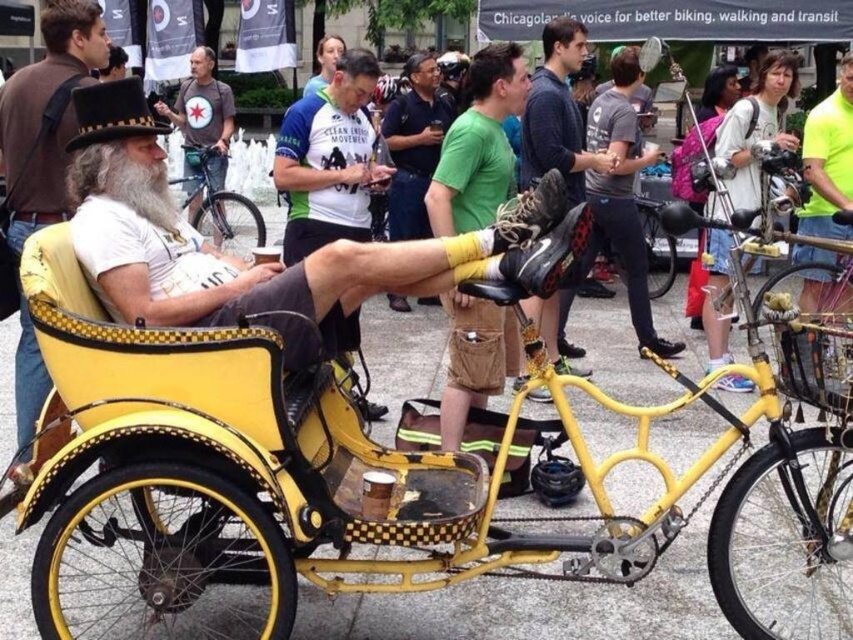
You are a photographer trying to capture a photo of both the green cotton shirt at center and the shiny metallic bicycle at center. Since they are both at the center, how are they positioned relative to each other?

The green cotton shirt at center is positioned to the right of the shiny metallic bicycle at center.